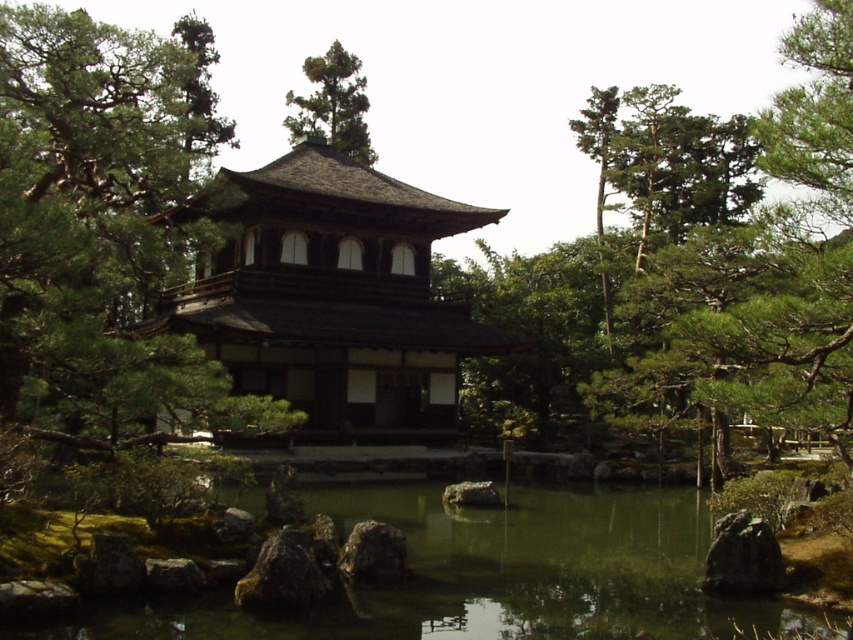
This screenshot has width=853, height=640. What do you see at coordinates (787, 260) in the screenshot?
I see `green textured tree at upper center` at bounding box center [787, 260].

This screenshot has height=640, width=853. In order to click on green textured tree at upper center in this screenshot , I will do `click(787, 260)`.

Does dark brown wooden temple at center have a lesser width compared to green textured tree at upper center?

In fact, dark brown wooden temple at center might be wider than green textured tree at upper center.

Does dark brown wooden temple at center appear under green textured tree at upper center?

Correct, dark brown wooden temple at center is located below green textured tree at upper center.

You are a GUI agent. You are given a task and a screenshot of the screen. Output one action in this format:
    pyautogui.click(x=<x>, y=<y>)
    Task: Click on the dark brown wooden temple at center
    
    Given the screenshot: What is the action you would take?
    pyautogui.click(x=334, y=296)

I want to click on dark brown wooden temple at center, so click(x=334, y=296).

From the picture: Does green reflective water at center have a greater height compared to smooth gray rock at center?

Yes.

Is green reflective water at center closer to the viewer compared to smooth gray rock at center?

Yes, green reflective water at center is closer to the viewer.

Does point (408, 509) lie in front of point (357, 561)?

No, (408, 509) is further to viewer.

I want to click on green reflective water at center, so click(x=486, y=576).